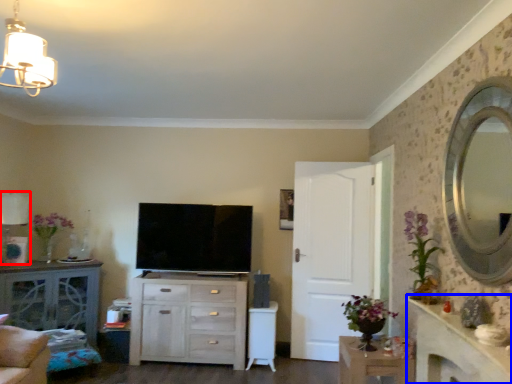
Question: Which object is closer to the camera taking this photo, lamp (highlighted by a red box) or counter top (highlighted by a blue box)?

Choices:
 (A) lamp
 (B) counter top

Answer: (B)